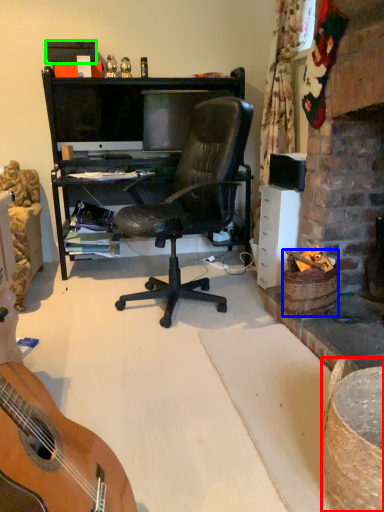
Question: Which is farther away from picnic basket (highlighted by a red box)? picnic basket (highlighted by a blue box) or box (highlighted by a green box)?

Choices:
 (A) picnic basket
 (B) box

Answer: (B)